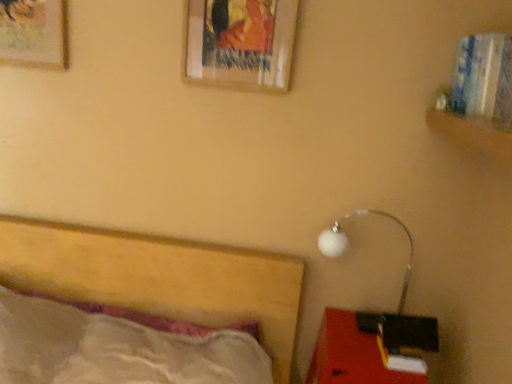
Question: Is white glossy lamp at lower right taller or shorter than wooden picture frame at upper left, the first picture frame viewed from the left?

Choices:
 (A) short
 (B) tall

Answer: (B)

Question: In terms of width, does white glossy lamp at lower right look wider or thinner when compared to wooden picture frame at upper left, the first picture frame viewed from the left?

Choices:
 (A) wide
 (B) thin

Answer: (A)

Question: Which object is the closest to the wooden picture frame at upper center, positioned as the second picture frame in left-to-right order?

Choices:
 (A) wooden picture frame at upper left, the first picture frame viewed from the left
 (B) white glossy lamp at lower right
 (C) matte red desk at lower right

Answer: (A)

Question: Which object is positioned farthest from the wooden picture frame at upper center, positioned as the second picture frame in left-to-right order?

Choices:
 (A) white glossy lamp at lower right
 (B) matte red desk at lower right
 (C) wooden picture frame at upper left, the first picture frame viewed from the left

Answer: (B)